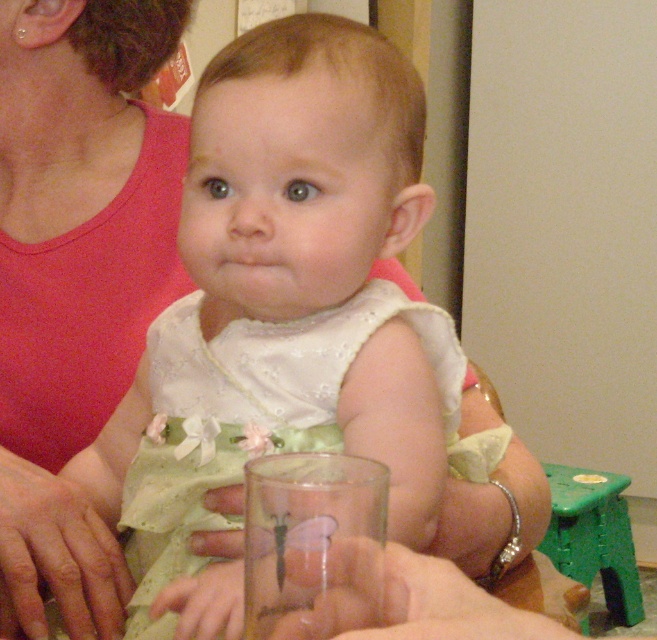
Can you confirm if white satin dress at center is wider than transparent glass at center?

Yes.

Does white satin dress at center have a larger size compared to transparent glass at center?

Yes, white satin dress at center is bigger than transparent glass at center.

Identify the location of white satin dress at center. (298, 275).

Can you confirm if matte pink tank top at upper left is thinner than transparent glass at center?

In fact, matte pink tank top at upper left might be wider than transparent glass at center.

Locate an element on the screen. The image size is (657, 640). matte pink tank top at upper left is located at coordinates (76, 275).

You are a GUI agent. You are given a task and a screenshot of the screen. Output one action in this format:
    pyautogui.click(x=<x>, y=<y>)
    Task: Click on the matte pink tank top at upper left
    
    Given the screenshot: What is the action you would take?
    pyautogui.click(x=76, y=275)

Looking at this image, can you confirm if white satin dress at center is wider than matte pink tank top at upper left?

Yes.

Is the position of white satin dress at center more distant than that of matte pink tank top at upper left?

No, white satin dress at center is closer to the viewer.

Is point (369, 412) positioned before point (154, 234)?

Yes, it is.

This screenshot has width=657, height=640. I want to click on white satin dress at center, so click(x=298, y=275).